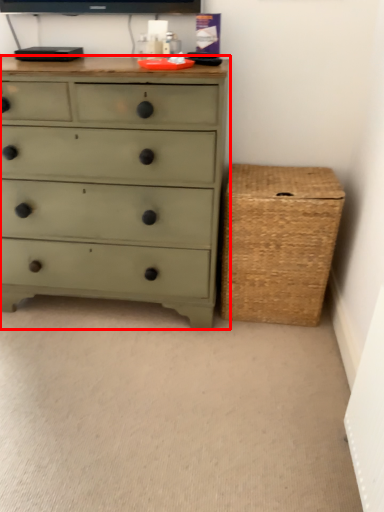
Question: Where is chest of drawers (annotated by the red box) located in relation to basket in the image?

Choices:
 (A) right
 (B) left

Answer: (B)